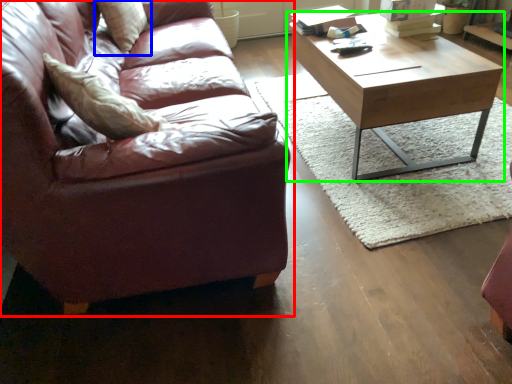
Question: Which object is the closest to the studio couch (highlighted by a red box)? Choose among these: pillow (highlighted by a blue box) or coffee table (highlighted by a green box).

Choices:
 (A) pillow
 (B) coffee table

Answer: (A)